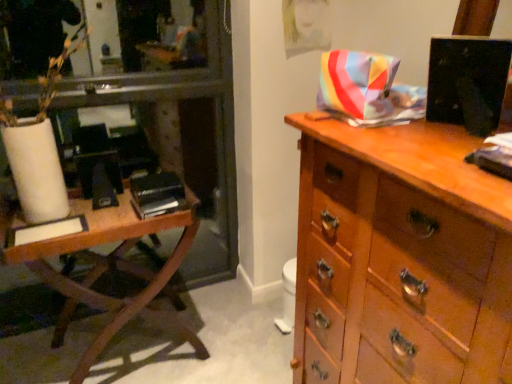
What are the coordinates of `black glossy monitor at upper right` in the screenshot? It's located at (468, 82).

Locate an element on the screen. The width and height of the screenshot is (512, 384). wooden table at left is located at coordinates (106, 268).

What do you see at coordinates (106, 268) in the screenshot? This screenshot has height=384, width=512. I see `wooden table at left` at bounding box center [106, 268].

Describe the element at coordinates (400, 258) in the screenshot. This screenshot has width=512, height=384. I see `wooden chest of drawers at right` at that location.

In order to click on white matte vase at left in this screenshot , I will do `click(39, 146)`.

From a real-world perspective, between wooden chest of drawers at right and black glossy monitor at upper right, who is vertically higher?

In real-world perspective, black glossy monitor at upper right is above.

Between wooden chest of drawers at right and black glossy monitor at upper right, which one is positioned behind?

black glossy monitor at upper right is behind.

Who is taller, wooden chest of drawers at right or black glossy monitor at upper right?

wooden chest of drawers at right is taller.

From the image's perspective, between wooden chest of drawers at right and black glossy monitor at upper right, which one is located above?

black glossy monitor at upper right appears higher in the image.

Which is farther, (421,215) or (42,207)?

Positioned behind is point (42,207).

Measure the distance between wooden chest of drawers at right and white matte vase at left.

wooden chest of drawers at right and white matte vase at left are 3.36 feet apart from each other.

From a real-world perspective, which object rests below the other?

wooden chest of drawers at right is physically lower.

Is wooden chest of drawers at right oriented away from white matte vase at left?

No, wooden chest of drawers at right is not facing the opposite direction of white matte vase at left.

In terms of size, does black matte book at left appear bigger or smaller than wooden chest of drawers at right?

Considering their sizes, black matte book at left takes up less space than wooden chest of drawers at right.

Does black matte book at left turn towards wooden chest of drawers at right?

No, black matte book at left is not aimed at wooden chest of drawers at right.

This screenshot has height=384, width=512. In order to click on the chest of drawers beneath the black matte book at left (from a real-world perspective) in this screenshot , I will do `click(400, 258)`.

From the image's perspective, is wooden table at left above black matte book at left?

Incorrect, from the image's perspective, wooden table at left is lower than black matte book at left.

From a real-world perspective, is wooden table at left physically below black matte book at left?

Indeed, from a real-world perspective, wooden table at left is positioned beneath black matte book at left.

The image size is (512, 384). Find the location of `table below the black matte book at left (from the image's perspective)`. table below the black matte book at left (from the image's perspective) is located at coordinates (106, 268).

Based on the photo, from the image's perspective, which one is positioned lower, black glossy monitor at upper right or wooden chest of drawers at right?

wooden chest of drawers at right is shown below in the image.

Between black glossy monitor at upper right and wooden chest of drawers at right, which one is positioned behind?

black glossy monitor at upper right is behind.

Is black glossy monitor at upper right placed right next to wooden chest of drawers at right?

black glossy monitor at upper right and wooden chest of drawers at right are clearly separated.

Consider the image. Is black glossy monitor at upper right inside the boundaries of wooden chest of drawers at right, or outside?

black glossy monitor at upper right is located beyond the bounds of wooden chest of drawers at right.

From the image's perspective, which one is positioned higher, black matte book at left or wooden table at left?

From the image's view, black matte book at left is above.

Is black matte book at left oriented away from wooden table at left?

Absolutely, black matte book at left is directed away from wooden table at left.

From a real-world perspective, is black matte book at left above or below wooden table at left?

In terms of real-world spatial position, black matte book at left is above wooden table at left.

Are black matte book at left and wooden table at left making contact?

No, black matte book at left is not making contact with wooden table at left.

Is the depth of black matte book at left greater than that of white matte vase at left?

Yes.

Considering the relative positions of black matte book at left and white matte vase at left in the image provided, is black matte book at left to the right of white matte vase at left from the viewer's perspective?

Yes, black matte book at left is to the right of white matte vase at left.

Could you tell me if black matte book at left is facing white matte vase at left?

No, black matte book at left does not turn towards white matte vase at left.

Is point (151, 177) farther from viewer compared to point (9, 157)?

Yes, it is behind point (9, 157).

The height and width of the screenshot is (384, 512). Find the location of `the chest of drawers that is in front of the black glossy monitor at upper right`. the chest of drawers that is in front of the black glossy monitor at upper right is located at coordinates (400, 258).

This screenshot has width=512, height=384. Identify the location of the chest of drawers located underneath the white matte vase at left (from a real-world perspective). click(400, 258).

From the image, which object appears to be farther from black matte book at left, white matte vase at left or black glossy monitor at upper right?

black glossy monitor at upper right lies further to black matte book at left than the other object.

Which object lies further to the anchor point wooden table at left, black glossy monitor at upper right or wooden chest of drawers at right?

black glossy monitor at upper right is further to wooden table at left.

When comparing their distances from wooden table at left, does black matte book at left or wooden chest of drawers at right seem closer?

Among the two, black matte book at left is located nearer to wooden table at left.

Looking at the image, which one is located closer to wooden table at left, wooden chest of drawers at right or black glossy monitor at upper right?

wooden chest of drawers at right is positioned closer to the anchor wooden table at left.

Considering their positions, is wooden table at left positioned closer to white matte vase at left than black matte book at left?

wooden table at left lies closer to white matte vase at left than the other object.

Which object lies nearer to the anchor point wooden table at left, white matte vase at left or wooden chest of drawers at right?

Based on the image, white matte vase at left appears to be nearer to wooden table at left.

Looking at the image, which one is located further to wooden chest of drawers at right, black glossy monitor at upper right or white matte vase at left?

Among the two, white matte vase at left is located further to wooden chest of drawers at right.

Based on their spatial positions, is wooden chest of drawers at right or black matte book at left further from white matte vase at left?

Based on the image, wooden chest of drawers at right appears to be further to white matte vase at left.

Where is `table between white matte vase at left and wooden chest of drawers at right from left to right`? table between white matte vase at left and wooden chest of drawers at right from left to right is located at coordinates coord(106,268).

What are the coordinates of `chest of drawers between white matte vase at left and black glossy monitor at upper right` in the screenshot? It's located at (400, 258).

Locate an element on the screen. The image size is (512, 384). book between white matte vase at left and black glossy monitor at upper right is located at coordinates (157, 194).

Where is `book between wooden table at left and wooden chest of drawers at right from left to right`? book between wooden table at left and wooden chest of drawers at right from left to right is located at coordinates (157, 194).